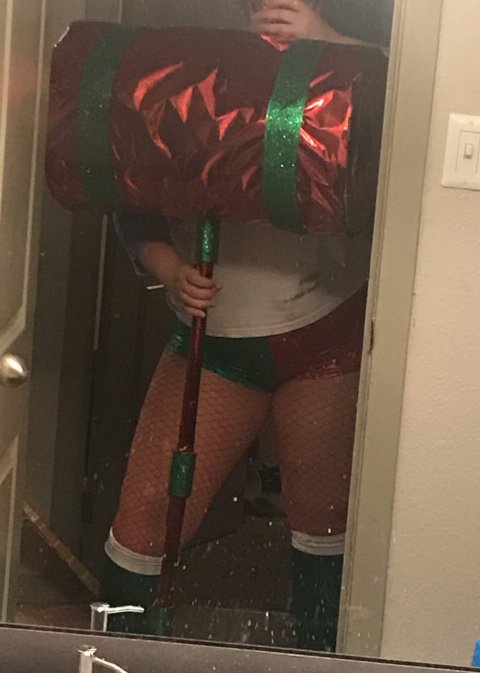
The height and width of the screenshot is (673, 480). Identify the location of the bottom center of mirror. click(168, 635).